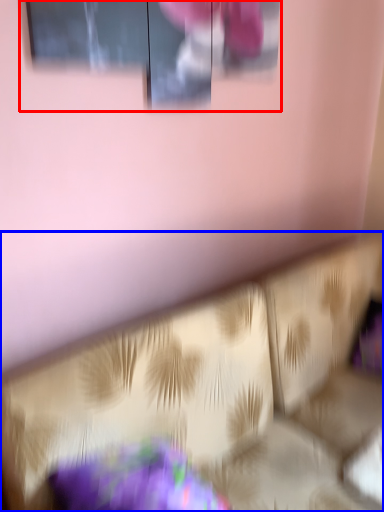
Question: Which point is further to the camera, window (highlighted by a red box) or furniture (highlighted by a blue box)?

Choices:
 (A) window
 (B) furniture

Answer: (A)